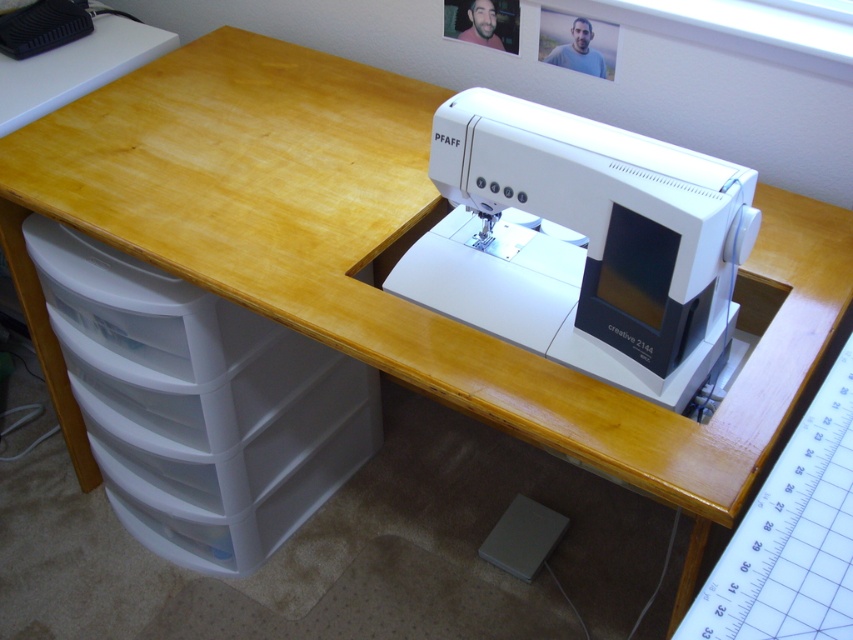
Question: Is white plastic sewing machine at center to the left of white plastic drawer at lower left from the viewer's perspective?

Choices:
 (A) yes
 (B) no

Answer: (B)

Question: Does white plastic sewing machine at center have a larger size compared to white plastic drawer at lower left?

Choices:
 (A) no
 (B) yes

Answer: (A)

Question: Which of the following is the closest to the observer?

Choices:
 (A) white plastic sewing machine at center
 (B) white plastic drawer at lower left

Answer: (A)

Question: Which object appears farthest from the camera in this image?

Choices:
 (A) white plastic drawer at lower left
 (B) white plastic sewing machine at center

Answer: (A)

Question: In this image, where is white plastic sewing machine at center located relative to white plastic drawer at lower left?

Choices:
 (A) right
 (B) left

Answer: (A)